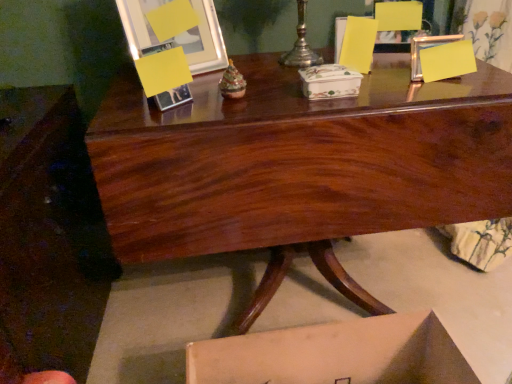
Question: From the image's perspective, is metallic silver picture frame at upper left below glossy wood desk at center?

Choices:
 (A) no
 (B) yes

Answer: (A)

Question: From the image's perspective, would you say metallic silver picture frame at upper left is positioned over glossy wood desk at center?

Choices:
 (A) yes
 (B) no

Answer: (A)

Question: From a real-world perspective, is metallic silver picture frame at upper left located beneath glossy wood desk at center?

Choices:
 (A) yes
 (B) no

Answer: (B)

Question: Is metallic silver picture frame at upper left at the right side of glossy wood desk at center?

Choices:
 (A) no
 (B) yes

Answer: (A)

Question: Does metallic silver picture frame at upper left lie in front of glossy wood desk at center?

Choices:
 (A) no
 (B) yes

Answer: (A)

Question: Does point (278, 157) appear closer or farther from the camera than point (298, 24)?

Choices:
 (A) closer
 (B) farther

Answer: (A)

Question: Is glossy wood desk at center wider or thinner than silver metallic candle holder at upper center?

Choices:
 (A) thin
 (B) wide

Answer: (B)

Question: From the image's perspective, relative to silver metallic candle holder at upper center, is glossy wood desk at center above or below?

Choices:
 (A) above
 (B) below

Answer: (B)

Question: Is glossy wood desk at center inside the boundaries of silver metallic candle holder at upper center, or outside?

Choices:
 (A) inside
 (B) outside

Answer: (B)

Question: Looking at the image, does metallic silver picture frame at upper left seem bigger or smaller compared to matte wood armchair at upper right?

Choices:
 (A) big
 (B) small

Answer: (A)

Question: From a real-world perspective, is metallic silver picture frame at upper left above or below matte wood armchair at upper right?

Choices:
 (A) above
 (B) below

Answer: (A)

Question: In the image, is metallic silver picture frame at upper left positioned in front of or behind matte wood armchair at upper right?

Choices:
 (A) behind
 (B) front

Answer: (B)

Question: Is metallic silver picture frame at upper left situated inside matte wood armchair at upper right or outside?

Choices:
 (A) inside
 (B) outside

Answer: (B)

Question: In the image, is matte wood armchair at upper right positioned in front of or behind glossy wood desk at center?

Choices:
 (A) behind
 (B) front

Answer: (A)

Question: From a real-world perspective, relative to glossy wood desk at center, is matte wood armchair at upper right vertically above or below?

Choices:
 (A) above
 (B) below

Answer: (A)